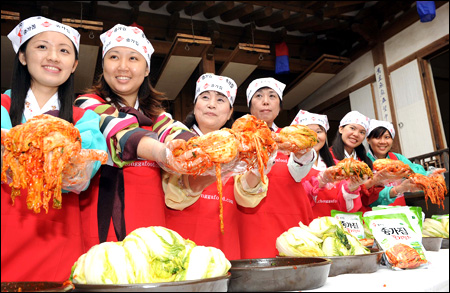
The image size is (450, 293). Identify the location of red aprons. (33, 225), (140, 207), (201, 217), (283, 210), (318, 199), (402, 201).